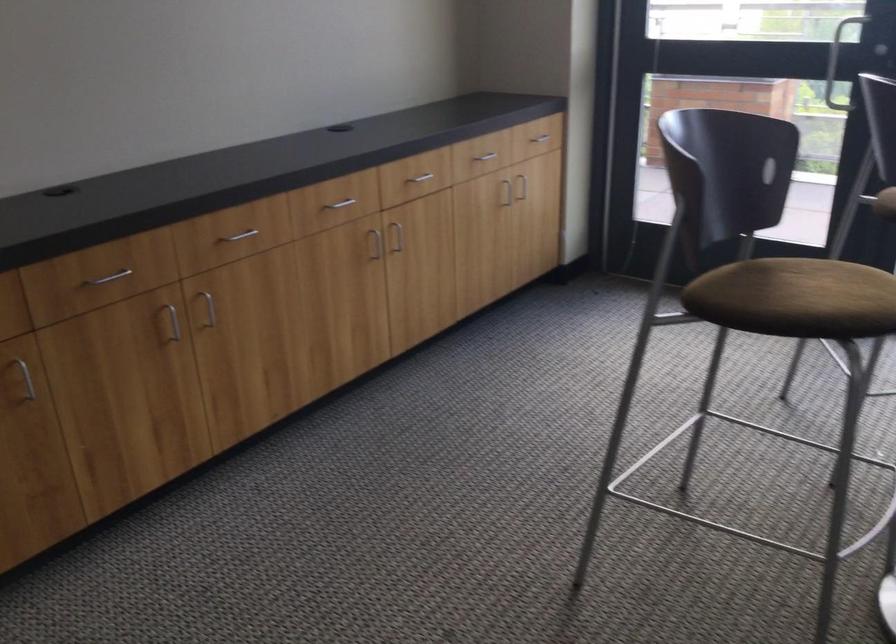
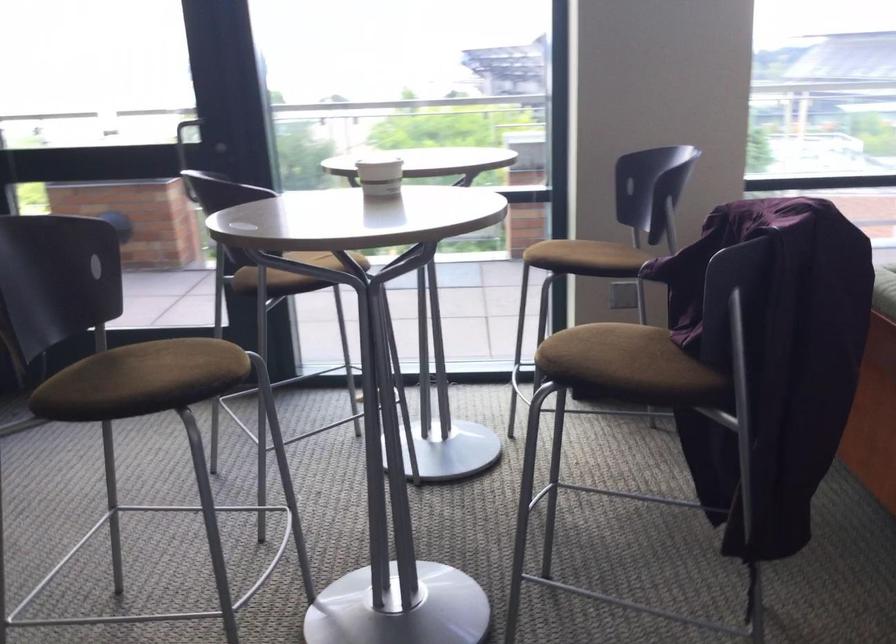
What movement of the cameraman would produce the second image?

The cameraman moved toward right, backward.